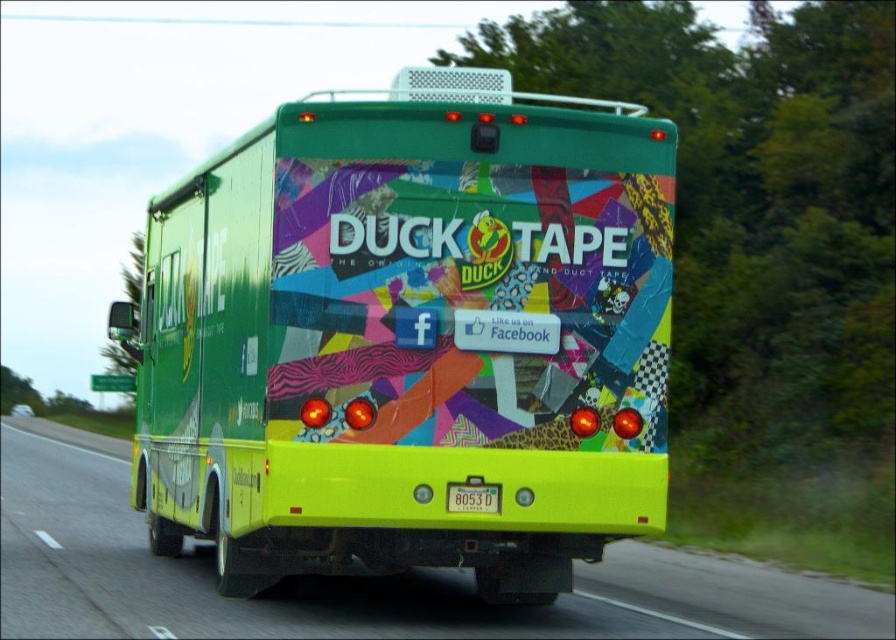
Question: Considering the real-world distances, which object is farthest from the green matte bus at center?

Choices:
 (A) yellow plastic license plate at rear
 (B) yellow glossy bus at center

Answer: (B)

Question: Which object appears closest to the camera in this image?

Choices:
 (A) yellow plastic license plate at rear
 (B) green matte bus at center

Answer: (B)

Question: Is the position of yellow glossy bus at center less distant than that of yellow plastic license plate at rear?

Choices:
 (A) yes
 (B) no

Answer: (B)

Question: Is yellow glossy bus at center wider than yellow plastic license plate at rear?

Choices:
 (A) yes
 (B) no

Answer: (A)

Question: Is the position of green matte bus at center less distant than that of yellow plastic license plate at rear?

Choices:
 (A) yes
 (B) no

Answer: (A)

Question: Estimate the real-world distances between objects in this image. Which object is farther from the yellow plastic license plate at rear?

Choices:
 (A) green matte bus at center
 (B) yellow glossy bus at center

Answer: (B)